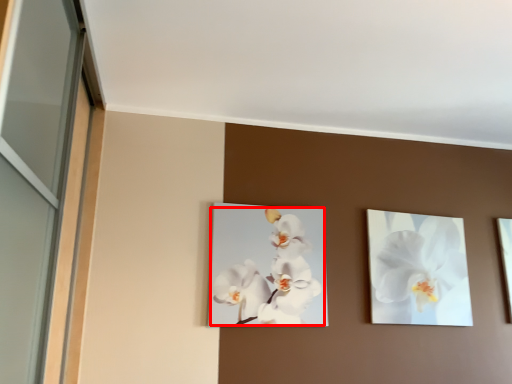
Question: From the image's perspective, considering the relative positions of flower (annotated by the red box) and flower in the image provided, where is flower (annotated by the red box) located with respect to the staircase?

Choices:
 (A) above
 (B) below

Answer: (A)